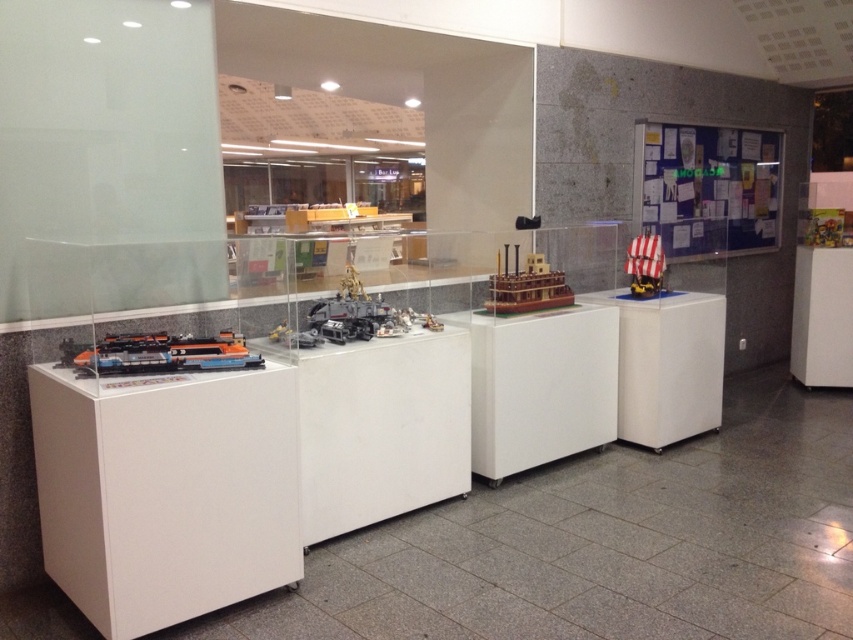
Question: Does white plastic table at right lie behind translucent plastic train at center?

Choices:
 (A) no
 (B) yes

Answer: (B)

Question: Estimate the real-world distances between objects in this image. Which object is farther from the translucent plastic steamboat at center?

Choices:
 (A) white striped wood ship at right
 (B) shiny metallic train at left
 (C) white plastic table at right
 (D) translucent plastic train at center

Answer: (B)

Question: Can you confirm if white plastic table at right is wider than white striped wood ship at right?

Choices:
 (A) no
 (B) yes

Answer: (B)

Question: Which of the following is the closest to the observer?

Choices:
 (A) shiny metallic train at left
 (B) translucent plastic train at center

Answer: (A)

Question: Which of these objects is positioned closest to the shiny metallic train at left?

Choices:
 (A) translucent plastic train at center
 (B) white plastic table at right

Answer: (A)

Question: Does shiny metallic train at left come in front of white striped wood ship at right?

Choices:
 (A) yes
 (B) no

Answer: (A)